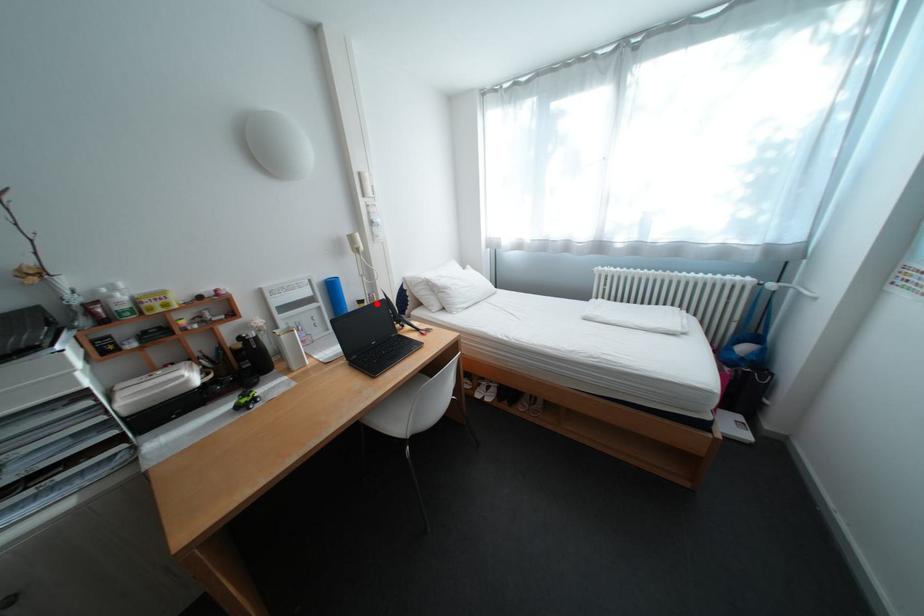
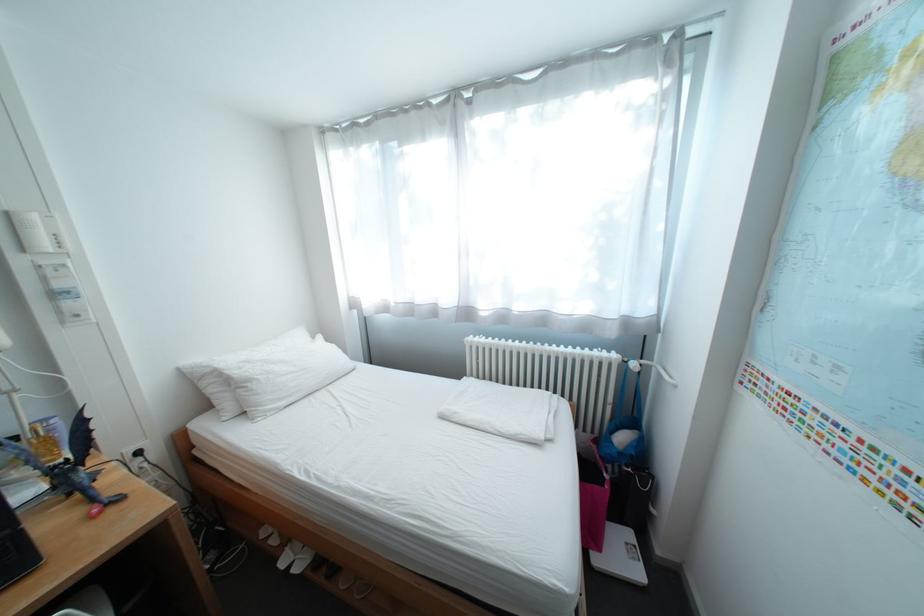
The point at the highlighted location is marked in the first image. Where is the corresponding point in the second image?

(31, 440)